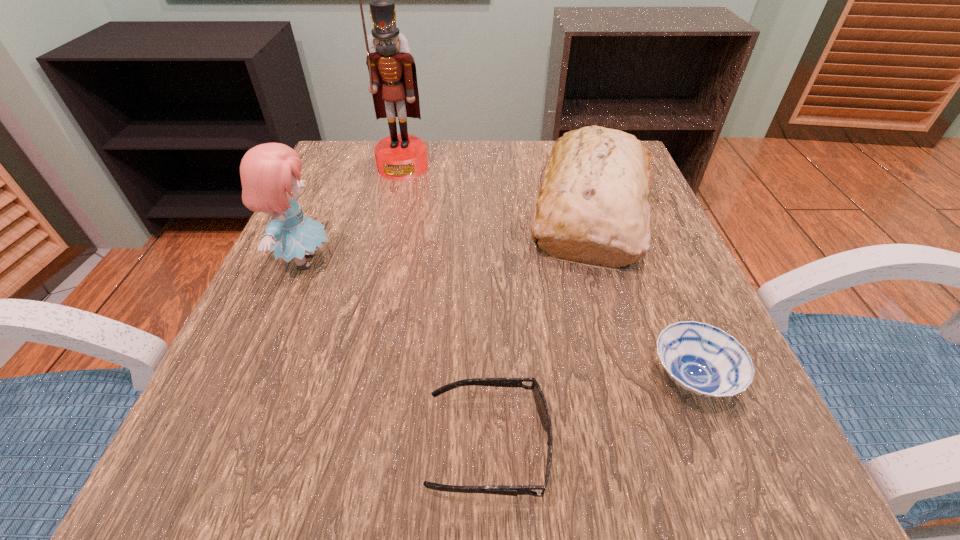
This screenshot has width=960, height=540. I want to click on free space between the bread and the third object from left to right, so click(x=540, y=327).

Find the location of a particular element. vacant area between the leftmost object and the third tallest object is located at coordinates (447, 235).

Where is `free spot between the leftmost object and the sunglasses`? Image resolution: width=960 pixels, height=540 pixels. free spot between the leftmost object and the sunglasses is located at coordinates (396, 353).

This screenshot has height=540, width=960. Find the location of `free space between the soup bowl and the fourth object from right to left`. free space between the soup bowl and the fourth object from right to left is located at coordinates (547, 273).

Find the location of a particular element. free spot between the soup bowl and the third shortest object is located at coordinates (641, 294).

Locate an element on the screen. This screenshot has width=960, height=540. free space that is in between the second object from left to right and the third object from left to right is located at coordinates (445, 306).

The image size is (960, 540). Find the location of `empty space between the third object from left to right and the doll`. empty space between the third object from left to right and the doll is located at coordinates (396, 353).

You are a GUI agent. You are given a task and a screenshot of the screen. Output one action in this format:
    pyautogui.click(x=<x>, y=<y>)
    Task: Click on the fourth closest object relative to the third object from left to right
    Image resolution: width=960 pixels, height=540 pixels.
    Given the screenshot: What is the action you would take?
    pyautogui.click(x=393, y=79)

Locate which object is the fourth closest to the third tallest object. Please provide its 2D coordinates. Your answer should be formatted as a tuple, i.e. [(x, y)], where the tuple contains the x and y coordinates of a point satisfying the conditions above.

[(270, 173)]

Locate an element on the screen. This screenshot has height=540, width=960. vacant space that satisfies the following two spatial constraints: 1. on the front-facing side of the third shortest object; 2. on the right side of the nutcracker is located at coordinates (393, 210).